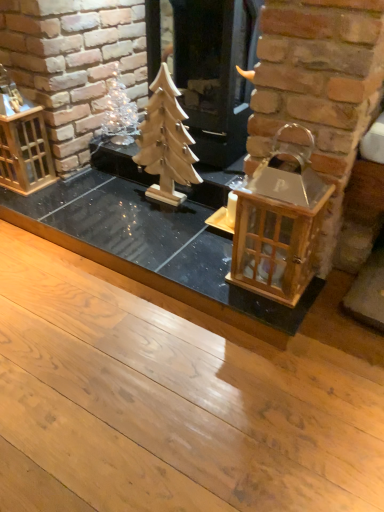
Find the location of a particular element. This screenshot has width=384, height=512. free space in front of wooden lantern at right is located at coordinates (268, 310).